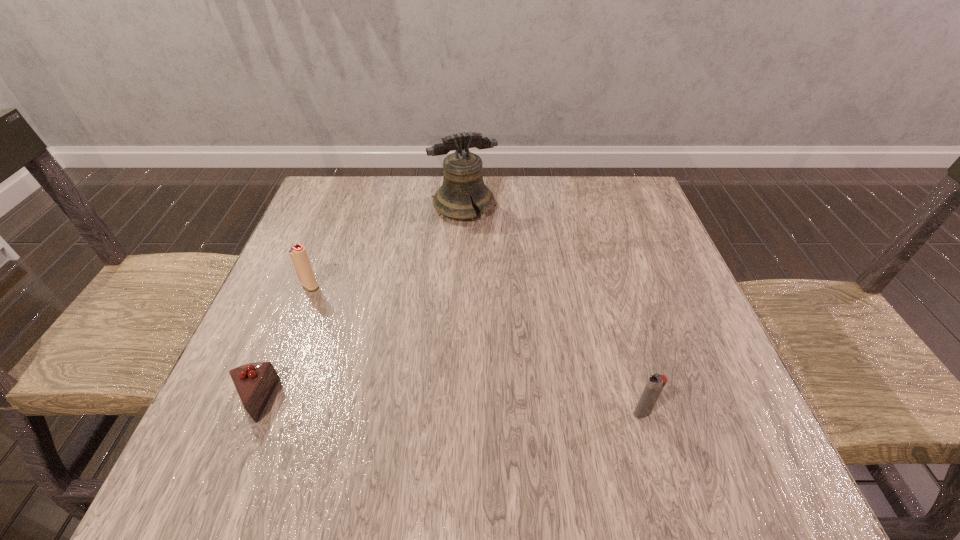
Find the location of `vacant space situated 0.060m on the front of the chocolate cake`. vacant space situated 0.060m on the front of the chocolate cake is located at coordinates (228, 459).

This screenshot has width=960, height=540. I want to click on object that is at the far edge, so click(463, 181).

Locate an element on the screen. igniter that is at the left edge is located at coordinates tap(299, 256).

This screenshot has width=960, height=540. I want to click on chocolate cake present at the left edge, so click(x=255, y=382).

Find the location of a particular element. The width and height of the screenshot is (960, 540). object located in the right edge section of the desktop is located at coordinates (655, 384).

Locate an element on the screen. This screenshot has height=540, width=960. vacant region at the far edge is located at coordinates (500, 199).

The height and width of the screenshot is (540, 960). I want to click on vacant space at the near edge of the desktop, so [x=376, y=458].

At what (x,y) coordinates should I click in order to perform the action: click on free space at the left edge of the desktop. Please return your answer as a coordinate pair (x, y). This screenshot has height=540, width=960. Looking at the image, I should click on (275, 320).

This screenshot has width=960, height=540. In order to click on free spot at the right edge of the desktop in this screenshot , I will do `click(638, 342)`.

Where is `vacant area at the far left corner of the desktop`? vacant area at the far left corner of the desktop is located at coordinates point(370,191).